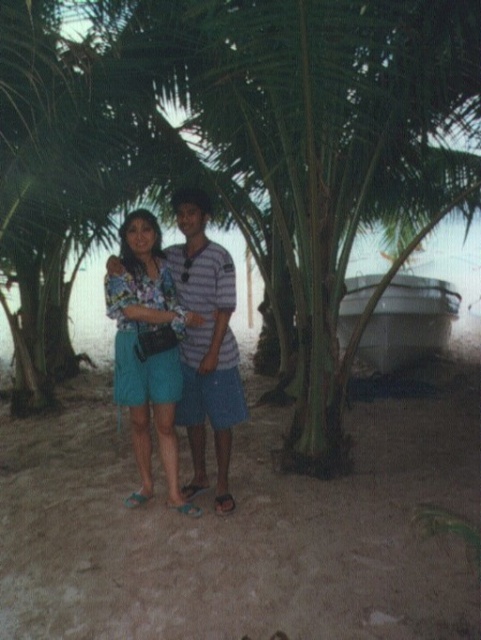
Question: Among these objects, which one is farthest from the camera?

Choices:
 (A) matte floral blouse at center
 (B) striped shirt at center

Answer: (B)

Question: Can you confirm if matte floral blouse at center is bigger than striped shirt at center?

Choices:
 (A) yes
 (B) no

Answer: (A)

Question: Which of the following is the closest to the observer?

Choices:
 (A) (87, 540)
 (B) (160, 397)

Answer: (A)

Question: Estimate the real-world distances between objects in this image. Which object is closer to the matte floral blouse at center?

Choices:
 (A) smooth sand at center
 (B) striped shirt at center

Answer: (B)

Question: Is smooth sand at center positioned behind striped shirt at center?

Choices:
 (A) no
 (B) yes

Answer: (B)

Question: Is matte floral blouse at center to the right of striped shirt at center from the viewer's perspective?

Choices:
 (A) no
 (B) yes

Answer: (A)